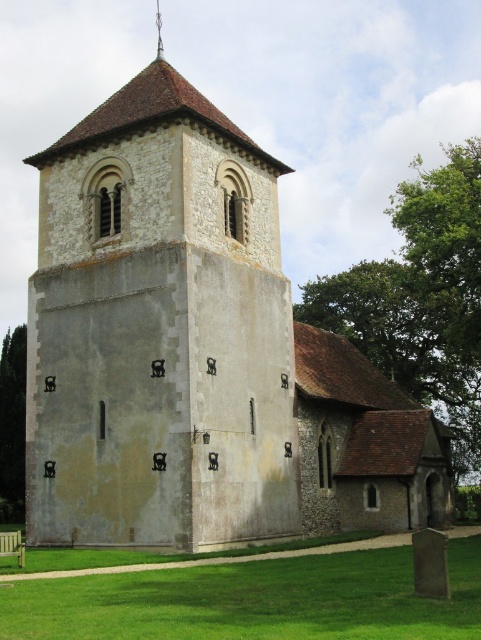
Does white stone tower at center have a larger size compared to green grass at lower center?

Indeed, white stone tower at center has a larger size compared to green grass at lower center.

Between white stone tower at center and green grass at lower center, which one is positioned lower?

green grass at lower center is lower down.

Is point (240, 212) positioned behind point (172, 628)?

That is True.

Where is `white stone tower at center`? Image resolution: width=481 pixels, height=640 pixels. white stone tower at center is located at coordinates (159, 330).